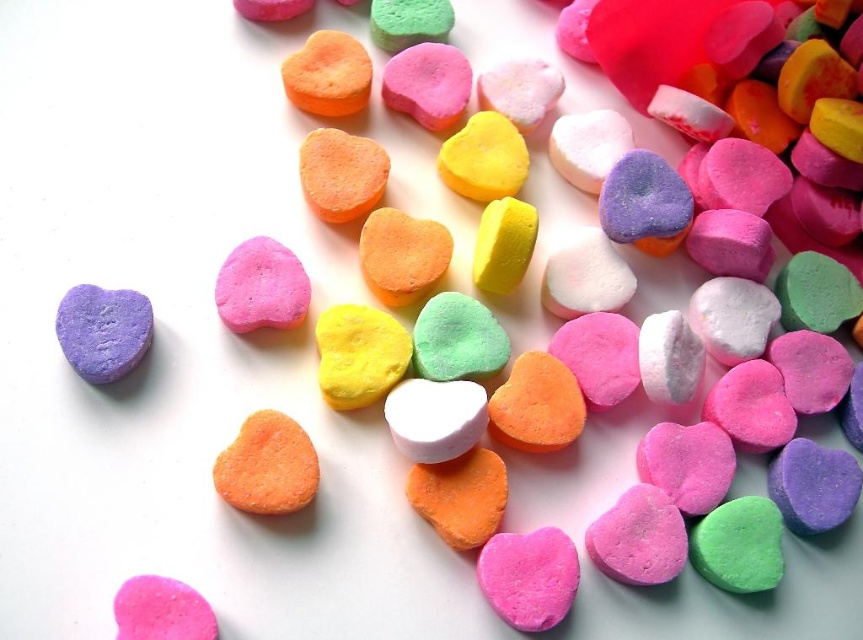
Is matte purple heart at left taller than matte pink heart at center?

No, matte purple heart at left is not taller than matte pink heart at center.

Does matte purple heart at left have a greater width compared to matte pink heart at center?

No.

Locate an element on the screen. The width and height of the screenshot is (863, 640). matte purple heart at left is located at coordinates (104, 330).

Who is positioned more to the right, matte pink heart at center or pink matte heart at lower left?

Positioned to the right is matte pink heart at center.

Can you confirm if matte pink heart at center is positioned below pink matte heart at lower left?

No, matte pink heart at center is not below pink matte heart at lower left.

Which is behind, point (276, 285) or point (143, 580)?

The point (276, 285) is behind.

Find the location of a particular element. Image resolution: width=863 pixels, height=640 pixels. matte pink heart at center is located at coordinates (261, 285).

Does pink matte heart at center have a smaller size compared to pink matte heart at lower left?

No.

Which is behind, point (533, 614) or point (121, 632)?

Positioned behind is point (533, 614).

Where is `pink matte heart at center`? The height and width of the screenshot is (640, 863). pink matte heart at center is located at coordinates (528, 577).

The height and width of the screenshot is (640, 863). I want to click on pink matte heart at center, so click(x=528, y=577).